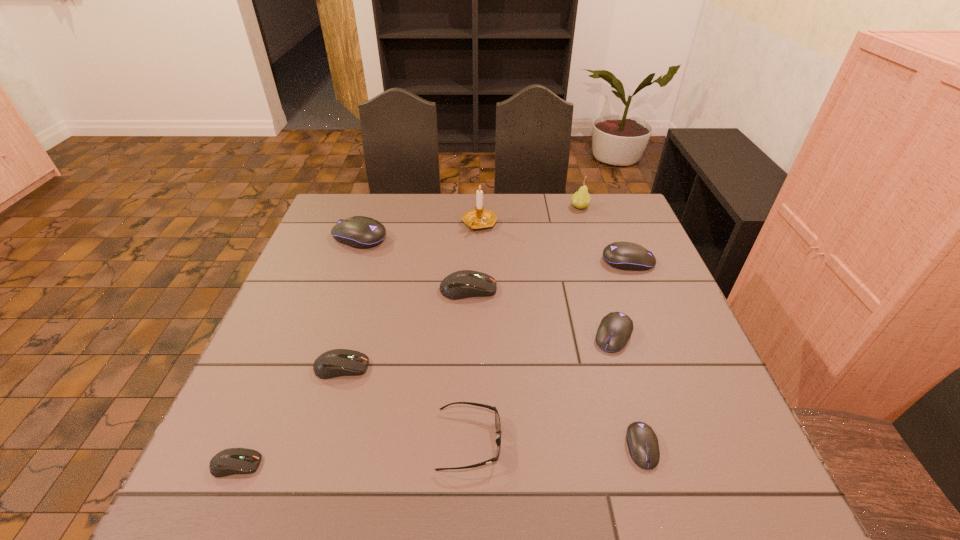
Select which object appears as the closest to the smallest black computer mouse. Please provide its 2D coordinates. Your answer should be formatted as a tuple, i.e. [(x, y)], where the tuple contains the x and y coordinates of a point satisfying the conditions above.

[(615, 329)]

At what (x,y) coordinates should I click in order to perform the action: click on object that is the fifth closest to the farthest dark computer equipment. Please return your answer as a coordinate pair (x, y). The width and height of the screenshot is (960, 540). Looking at the image, I should click on (628, 256).

The height and width of the screenshot is (540, 960). Identify the location of computer mouse that is the third closest to the fourth nearest computer mouse. (462, 284).

You are a GUI agent. You are given a task and a screenshot of the screen. Output one action in this format:
    pyautogui.click(x=<x>, y=<y>)
    Task: Click on the computer mouse that is the third closest to the black sunglasses
    Image resolution: width=960 pixels, height=540 pixels.
    Given the screenshot: What is the action you would take?
    pyautogui.click(x=615, y=329)

Locate an element on the screen. black computer mouse that is the third closest to the leftmost dark computer equipment is located at coordinates (615, 329).

Locate which black computer mouse ranks in proximity to the third nearest black computer mouse. Please provide its 2D coordinates. Your answer should be formatted as a tuple, i.e. [(x, y)], where the tuple contains the x and y coordinates of a point satisfying the conditions above.

[(615, 329)]

The width and height of the screenshot is (960, 540). Find the location of `dark computer equipment that is the second closest to the pear`. dark computer equipment that is the second closest to the pear is located at coordinates (334, 363).

Find the location of a particular element. dark computer equipment that is the second closest to the fifth farthest object is located at coordinates (230, 461).

Image resolution: width=960 pixels, height=540 pixels. I want to click on free spot that satisfies the following two spatial constraints: 1. on the back side of the smallest black computer mouse; 2. on the button of the farthest dark computer equipment, so click(596, 289).

Where is `free space that satisfies the following two spatial constraints: 1. on the button of the second smallest dark computer equipment; 2. on the right side of the smallest black computer mouse`? This screenshot has height=540, width=960. free space that satisfies the following two spatial constraints: 1. on the button of the second smallest dark computer equipment; 2. on the right side of the smallest black computer mouse is located at coordinates (318, 447).